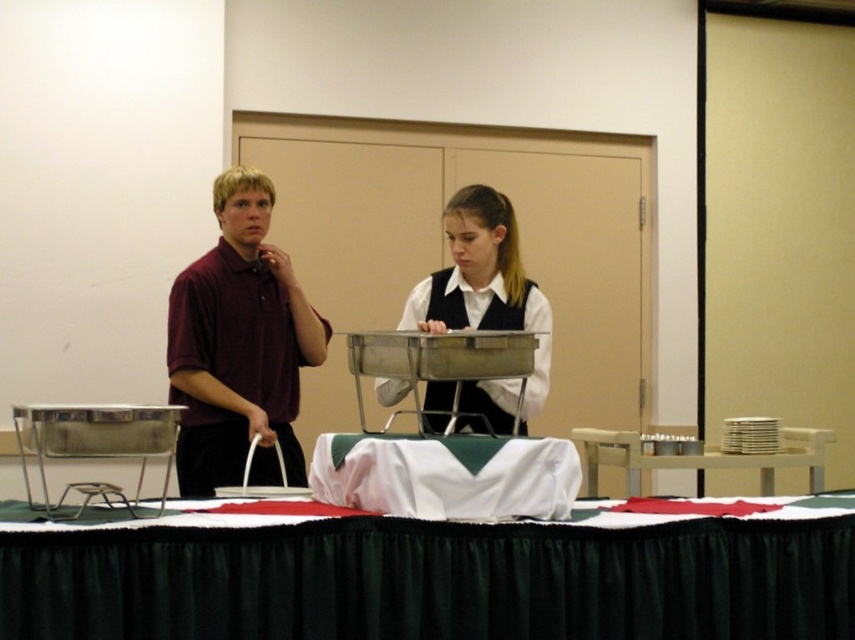
Who is higher up, white satin tablecloth at center or white wood table at right?

white satin tablecloth at center is above.

How distant is white satin tablecloth at center from white wood table at right?

white satin tablecloth at center is 1.56 meters from white wood table at right.

Who is more distant from viewer, [360,438] or [621,464]?

The point [621,464] is more distant.

Identify the location of white satin tablecloth at center. This screenshot has width=855, height=640. (447, 476).

Does maroon fabric shirt at left have a lesser width compared to white glossy vest at center?

Yes, maroon fabric shirt at left is thinner than white glossy vest at center.

This screenshot has height=640, width=855. I want to click on maroon fabric shirt at left, so click(x=239, y=348).

Does black fabric table at lower center have a greater height compared to maroon fabric shirt at left?

Incorrect, black fabric table at lower center's height is not larger of maroon fabric shirt at left's.

You are a GUI agent. You are given a task and a screenshot of the screen. Output one action in this format:
    pyautogui.click(x=<x>, y=<y>)
    Task: Click on the black fabric table at lower center
    The height and width of the screenshot is (640, 855).
    Given the screenshot: What is the action you would take?
    pyautogui.click(x=434, y=580)

This screenshot has width=855, height=640. I want to click on black fabric table at lower center, so click(x=434, y=580).

What are the coordinates of `black fabric table at lower center` in the screenshot? It's located at (434, 580).